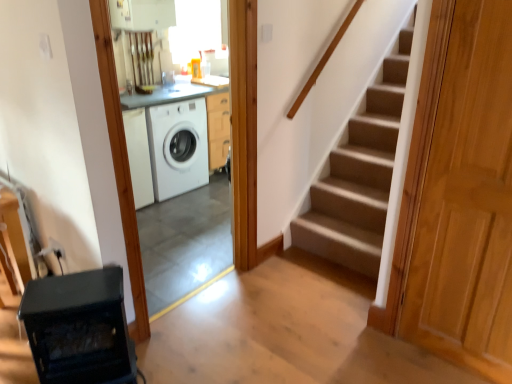
Image resolution: width=512 pixels, height=384 pixels. In order to click on vacant area on top of black glass stove at lower left (from a real-world perspective) in this screenshot , I will do `click(86, 286)`.